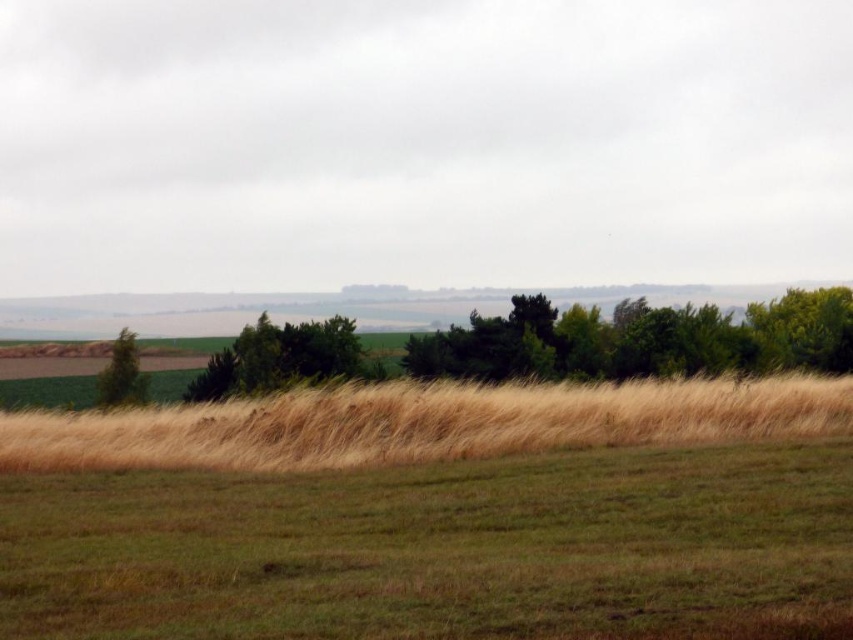
Can you confirm if dry grass at center is positioned to the right of green leafy tree at right?

No, dry grass at center is not to the right of green leafy tree at right.

Is point (850, 392) positioned in front of point (798, 291)?

That is True.

The width and height of the screenshot is (853, 640). What do you see at coordinates (422, 422) in the screenshot?
I see `dry grass at center` at bounding box center [422, 422].

Find the location of a particular element. dry grass at center is located at coordinates (422, 422).

Consider the image. Which is more to the left, green leafy tree at right or green matte tree at left?

From the viewer's perspective, green matte tree at left appears more on the left side.

Locate an element on the screen. The height and width of the screenshot is (640, 853). green leafy tree at right is located at coordinates (804, 328).

Who is higher up, dry grass at center or green matte tree at left?

dry grass at center is higher up.

Is dry grass at center to the right of green matte tree at left from the viewer's perspective?

Correct, you'll find dry grass at center to the right of green matte tree at left.

Is point (186, 417) in front of point (115, 348)?

That is True.

In order to click on dry grass at center in this screenshot , I will do `click(422, 422)`.